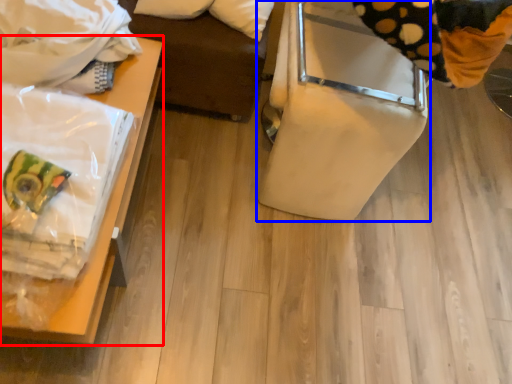
Question: Which object is closer to the camera taking this photo, furniture (highlighted by a red box) or furniture (highlighted by a blue box)?

Choices:
 (A) furniture
 (B) furniture

Answer: (A)